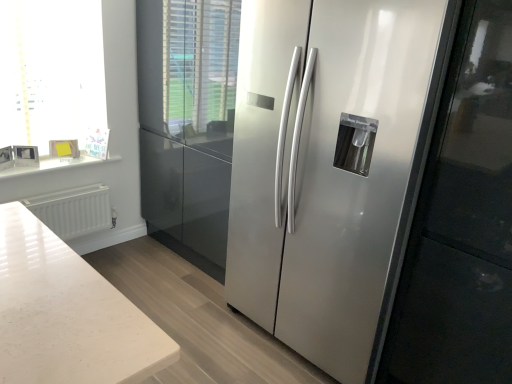
Where is `vacant region to the left of satin silver refrigerator at center`? vacant region to the left of satin silver refrigerator at center is located at coordinates (203, 322).